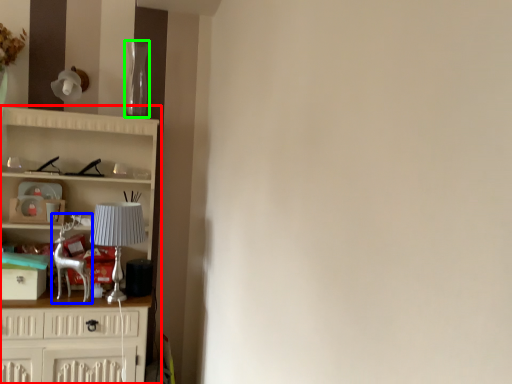
Question: Estimate the real-world distances between objects in this image. Which object is closer to cupboard (highlighted by a red box), swivel chair (highlighted by a blue box) or glass vase (highlighted by a green box)?

Choices:
 (A) swivel chair
 (B) glass vase

Answer: (A)